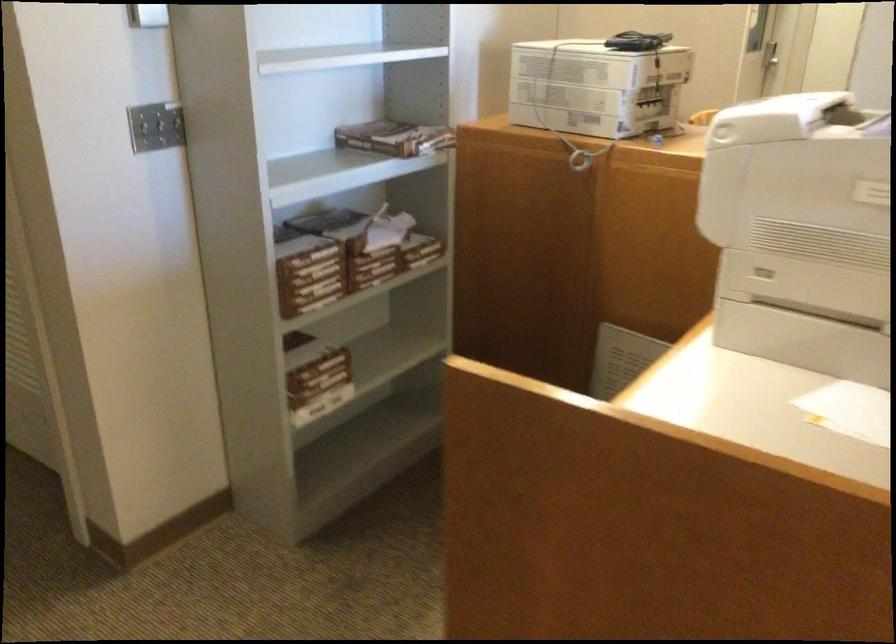
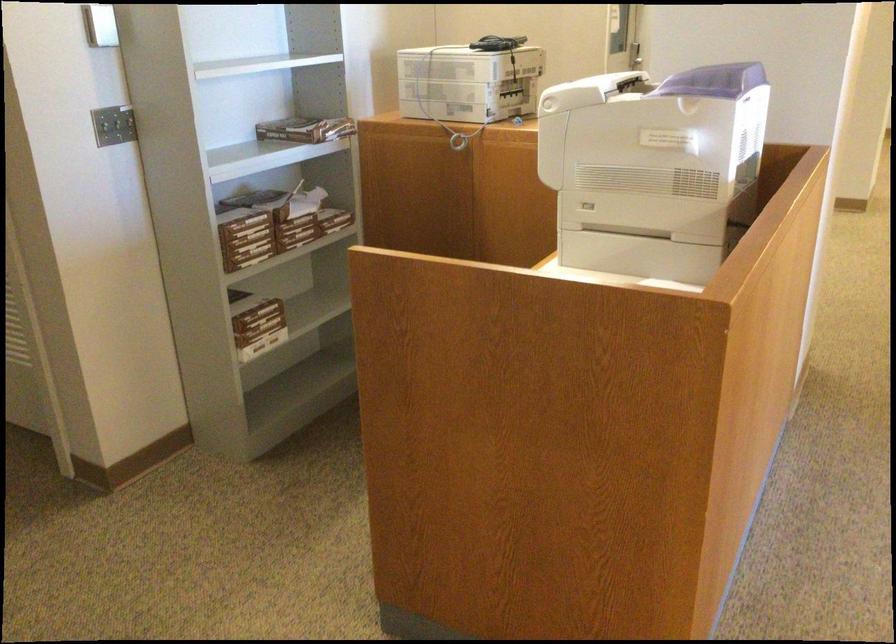
Find the pixel in the second image that matches (314,381) in the first image.

(257, 321)